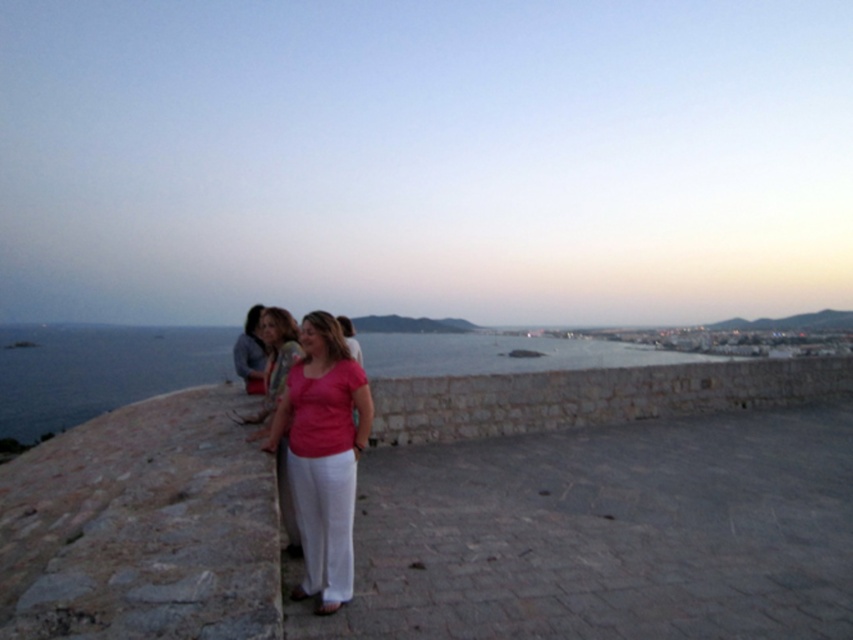
Which of these two, matte pink shirt at center or matte pink blouse at center, stands taller?

Standing taller between the two is matte pink shirt at center.

Does matte pink shirt at center lie in front of matte pink blouse at center?

That is True.

You are a GUI agent. You are given a task and a screenshot of the screen. Output one action in this format:
    pyautogui.click(x=<x>, y=<y>)
    Task: Click on the matte pink shirt at center
    
    Given the screenshot: What is the action you would take?
    pyautogui.click(x=323, y=456)

Between blue water at center and matte pink blouse at center, which one has less height?

Standing shorter between the two is matte pink blouse at center.

Which is above, blue water at center or matte pink blouse at center?

matte pink blouse at center is above.

You are a GUI agent. You are given a task and a screenshot of the screen. Output one action in this format:
    pyautogui.click(x=<x>, y=<y>)
    Task: Click on the blue water at center
    
    Given the screenshot: What is the action you would take?
    tap(99, 371)

Can you confirm if matte pink blouse at center is shorter than matte pink shirt at left?

Indeed, matte pink blouse at center has a lesser height compared to matte pink shirt at left.

Is matte pink blouse at center to the left of matte pink shirt at left from the viewer's perspective?

No, matte pink blouse at center is not to the left of matte pink shirt at left.

Locate an element on the screen. This screenshot has height=640, width=853. matte pink blouse at center is located at coordinates (273, 365).